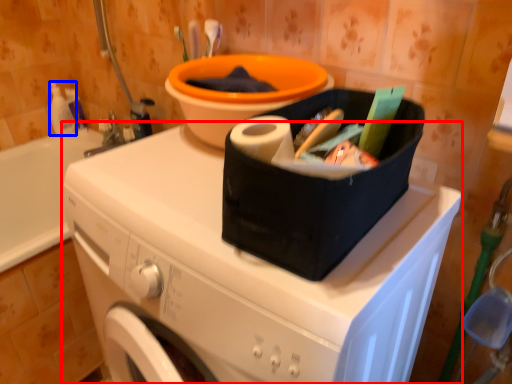
Question: Which point is closer to the camera, washing machine (highlighted by a red box) or cleaning product (highlighted by a blue box)?

Choices:
 (A) washing machine
 (B) cleaning product

Answer: (A)